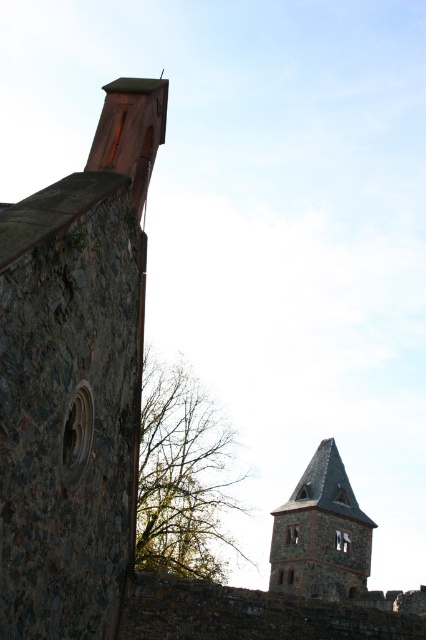
You are an architect analyzing the structure of the towers in this image. Which tower has a greater height between the rustic stone tower at upper right and the gray stone tower at center?

The gray stone tower at center is taller than the rustic stone tower at upper right.

You are standing at the center of the image and want to locate the rustic stone tower at upper right. According to the coordinates provided, in which direction should you look to find it?

The rustic stone tower at upper right is located at coordinates point (74, 378), which means it is positioned to the upper right relative to the center of the image. Therefore, you should look towards the upper right direction to find it.

You are standing in front of the stone wall with the chimney. You want to look at the tower in the distance. In which direction should you turn your head to see the rustic stone tower at upper right marked by point (74, 378)?

You should turn your head to the right to see the rustic stone tower at upper right marked by point (74, 378) because it is located to the right side of the stone wall with the chimney.